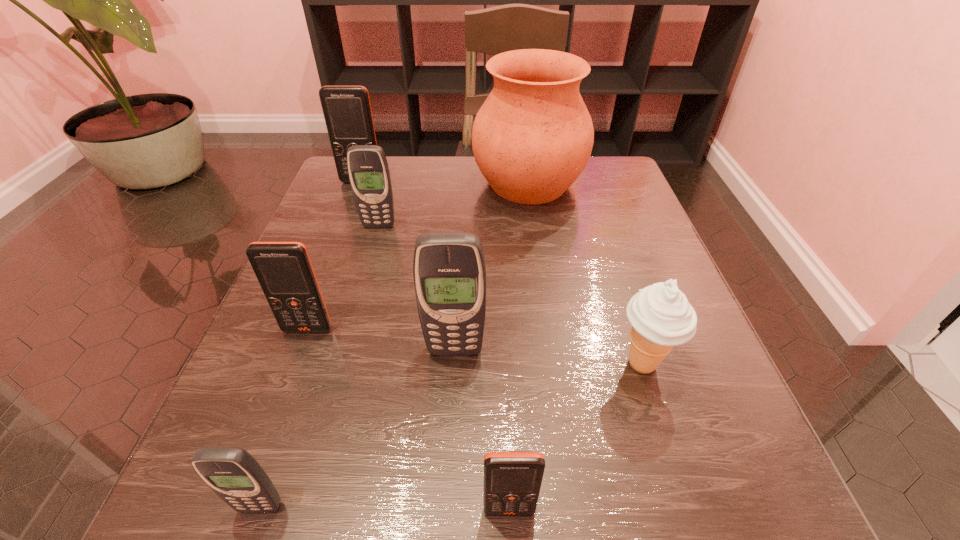
This screenshot has width=960, height=540. I want to click on free space at the far left corner, so click(327, 200).

You are a GUI agent. You are given a task and a screenshot of the screen. Output one action in this format:
    pyautogui.click(x=<x>, y=<y>)
    Task: Click on the free location at the near left corner
    This screenshot has height=540, width=960.
    Given the screenshot: What is the action you would take?
    pyautogui.click(x=177, y=529)

This screenshot has height=540, width=960. Find the location of `vacant space at the far right corner of the desktop`. vacant space at the far right corner of the desktop is located at coordinates (612, 156).

This screenshot has width=960, height=540. In the image, there is a desktop. Find the location of `vacant area at the near right corner`. vacant area at the near right corner is located at coordinates pos(731,496).

You are a GUI agent. You are given a task and a screenshot of the screen. Output one action in this format:
    pyautogui.click(x=<x>, y=<y>)
    Task: Click on the free spot between the fifth nearest object and the nearest gray cellular telephone
    
    Given the screenshot: What is the action you would take?
    pyautogui.click(x=284, y=418)

The width and height of the screenshot is (960, 540). What are the coordinates of `vacant space in between the farthest cellular telephone and the nearest gray cellular telephone` in the screenshot? It's located at (311, 344).

The image size is (960, 540). Find the location of `empty space between the biggest orange cellular telephone and the smallest gray cellular telephone`. empty space between the biggest orange cellular telephone and the smallest gray cellular telephone is located at coordinates (311, 344).

Locate an element on the screen. This screenshot has height=540, width=960. empty space between the farthest orange cellular telephone and the second nearest orange cellular telephone is located at coordinates (335, 255).

Where is `free space between the nearest orange cellular telephone and the icecream`? free space between the nearest orange cellular telephone and the icecream is located at coordinates (576, 436).

What are the coordinates of `vacant space that is in between the second biggest orange cellular telephone and the rightmost orange cellular telephone` in the screenshot? It's located at (409, 420).